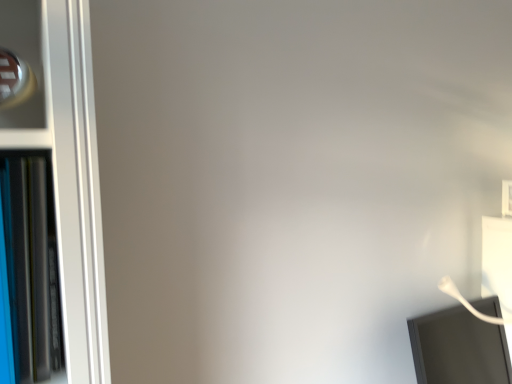
Question: Is point (435, 314) positioned closer to the camera than point (23, 291)?

Choices:
 (A) farther
 (B) closer

Answer: (A)

Question: Based on their positions, is white glossy computer monitor at lower right located to the left or right of blue glossy bookshelf at left?

Choices:
 (A) right
 (B) left

Answer: (A)

Question: Is white glossy computer monitor at lower right in front of or behind blue glossy bookshelf at left in the image?

Choices:
 (A) behind
 (B) front

Answer: (A)

Question: Visually, is blue glossy bookshelf at left positioned to the left or to the right of white glossy computer monitor at lower right?

Choices:
 (A) left
 (B) right

Answer: (A)

Question: From the image's perspective, is blue glossy bookshelf at left positioned above or below white glossy computer monitor at lower right?

Choices:
 (A) above
 (B) below

Answer: (A)

Question: From a real-world perspective, is blue glossy bookshelf at left above or below white glossy computer monitor at lower right?

Choices:
 (A) above
 (B) below

Answer: (A)

Question: In the image, is blue glossy bookshelf at left positioned in front of or behind white glossy computer monitor at lower right?

Choices:
 (A) front
 (B) behind

Answer: (A)